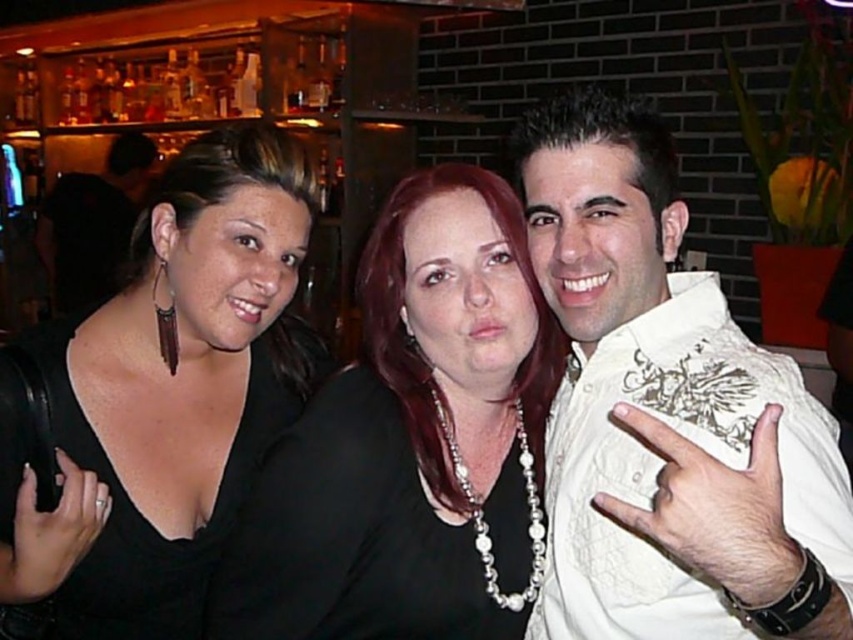
Looking at this image, between black fabric shirt at center and matte black shirt at left, which one is positioned higher?

matte black shirt at left is higher up.

Who is shorter, black fabric shirt at center or matte black shirt at left?

black fabric shirt at center is shorter.

What do you see at coordinates (397, 464) in the screenshot? Image resolution: width=853 pixels, height=640 pixels. I see `black fabric shirt at center` at bounding box center [397, 464].

The image size is (853, 640). I want to click on black fabric shirt at center, so pos(397,464).

Measure the distance between white textured shirt at right and camera.

white textured shirt at right and camera are 53.15 centimeters apart from each other.

Does white textured shirt at right have a lesser height compared to black fabric shirt at center?

No, white textured shirt at right is not shorter than black fabric shirt at center.

Locate an element on the screen. The image size is (853, 640). white textured shirt at right is located at coordinates (665, 410).

Who is more distant from viewer, (595, 561) or (146, 156)?

Point (146, 156)

Which is below, white textured shirt at right or matte black shirt at left?

white textured shirt at right is below.

The height and width of the screenshot is (640, 853). What do you see at coordinates (665, 410) in the screenshot?
I see `white textured shirt at right` at bounding box center [665, 410].

Where is `white textured shirt at right`? white textured shirt at right is located at coordinates (665, 410).